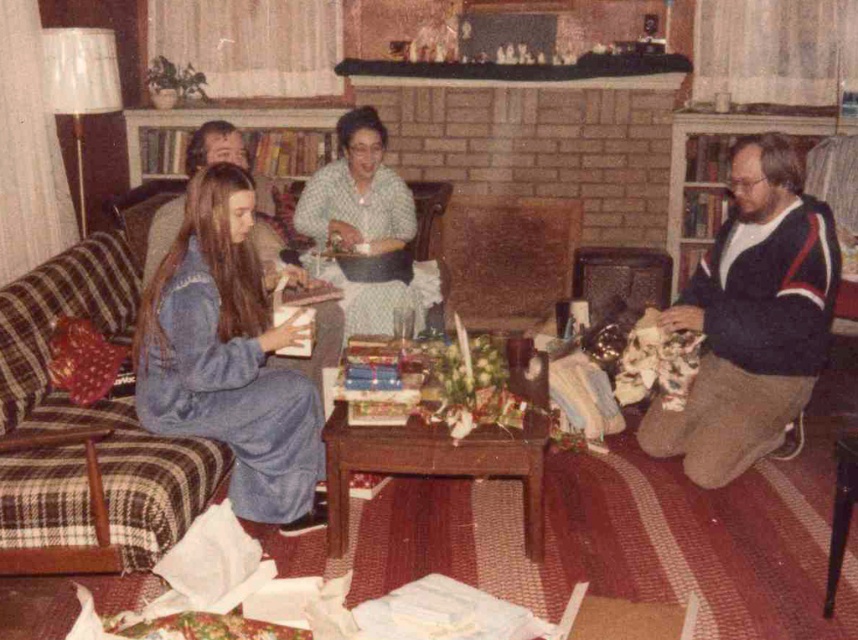
Does dark blue sweater at right have a greater width compared to light green fabric dress at center?

In fact, dark blue sweater at right might be narrower than light green fabric dress at center.

What do you see at coordinates (751, 317) in the screenshot?
I see `dark blue sweater at right` at bounding box center [751, 317].

Measure the distance between point (x=721, y=480) and camera.

Point (x=721, y=480) and camera are 9.77 feet apart.

The height and width of the screenshot is (640, 858). In order to click on dark blue sweater at right in this screenshot , I will do `click(751, 317)`.

Who is lower down, plaid fabric couch at left or blue knit sweater at center?

Positioned lower is plaid fabric couch at left.

Who is more distant from viewer, (45, 467) or (213, 147)?

The point (213, 147) is behind.

Who is more distant from viewer, (242, 348) or (216, 161)?

The point (216, 161) is more distant.

Where is `plaid fabric couch at left`? plaid fabric couch at left is located at coordinates (155, 454).

Is plaid fabric couch at left to the right of dark blue sweater at right from the viewer's perspective?

In fact, plaid fabric couch at left is to the left of dark blue sweater at right.

Which of these two, plaid fabric couch at left or dark blue sweater at right, stands shorter?

plaid fabric couch at left is shorter.

At what (x,y) coordinates should I click in order to perform the action: click on plaid fabric couch at left. Please return your answer as a coordinate pair (x, y). Looking at the image, I should click on (155, 454).

Find the location of a particular element. The image size is (858, 640). plaid fabric couch at left is located at coordinates (155, 454).